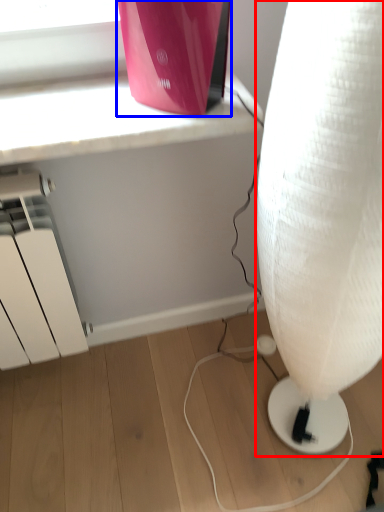
Question: Which object is closer to the camera taking this photo, lamp (highlighted by a red box) or appliance (highlighted by a blue box)?

Choices:
 (A) lamp
 (B) appliance

Answer: (A)